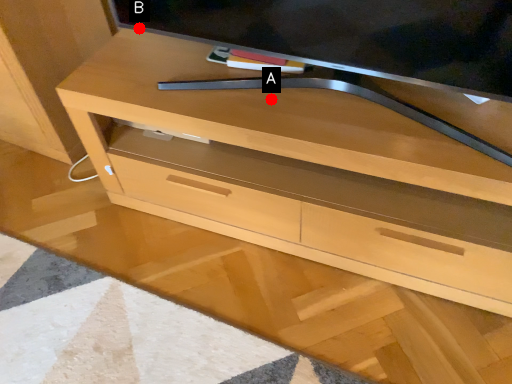
Question: Two points are circled on the image, labeled by A and B beside each circle. Which point is further to the camera?

Choices:
 (A) A is further
 (B) B is further

Answer: (B)